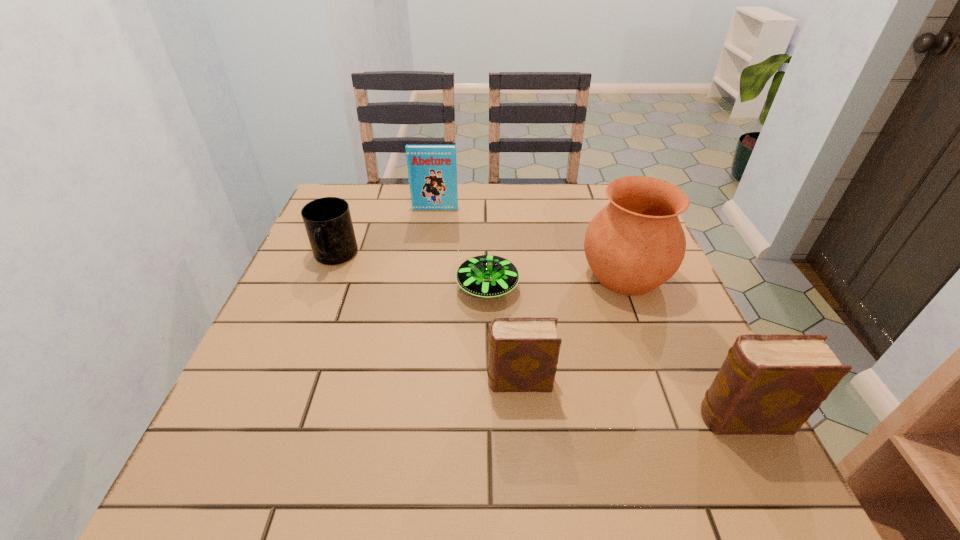
Locate an element on the screen. The width and height of the screenshot is (960, 540). vacant space that's between the leftmost object and the shortest object is located at coordinates [411, 272].

Identify the location of blank region between the pottery and the saucer. The width and height of the screenshot is (960, 540). (556, 281).

At what (x,y) coordinates should I click in order to perform the action: click on vacant point located between the fifth farthest object and the mug. Please return your answer as a coordinate pair (x, y). Looking at the image, I should click on (427, 319).

Identify the location of vacant space in between the second object from left to right and the nearest object. This screenshot has height=540, width=960. [x=589, y=314].

Image resolution: width=960 pixels, height=540 pixels. I want to click on vacant space in between the mug and the farther diary, so click(427, 319).

Where is `object that is the fifth closest to the mug`? This screenshot has height=540, width=960. object that is the fifth closest to the mug is located at coordinates (768, 384).

Identify which object is the fifth nearest to the nearer diary. Please provide its 2D coordinates. Your answer should be formatted as a tuple, i.e. [(x, y)], where the tuple contains the x and y coordinates of a point satisfying the conditions above.

[(432, 170)]

At what (x,y) coordinates should I click in order to perform the action: click on vacant area in the image that satisfies the following two spatial constraints: 1. on the front cover of the farthest object; 2. on the left side of the saucer. Please return your answer as a coordinate pair (x, y). Looking at the image, I should click on (424, 287).

Where is `free space that satisfies the following two spatial constraints: 1. on the front cover of the farthest object; 2. on the left side of the saucer`? free space that satisfies the following two spatial constraints: 1. on the front cover of the farthest object; 2. on the left side of the saucer is located at coordinates (424, 287).

At what (x,y) coordinates should I click in order to perform the action: click on vacant area that satisfies the following two spatial constraints: 1. on the back side of the pottery; 2. on the left side of the shortest object. Please return your answer as a coordinate pair (x, y). The width and height of the screenshot is (960, 540). Looking at the image, I should click on (488, 275).